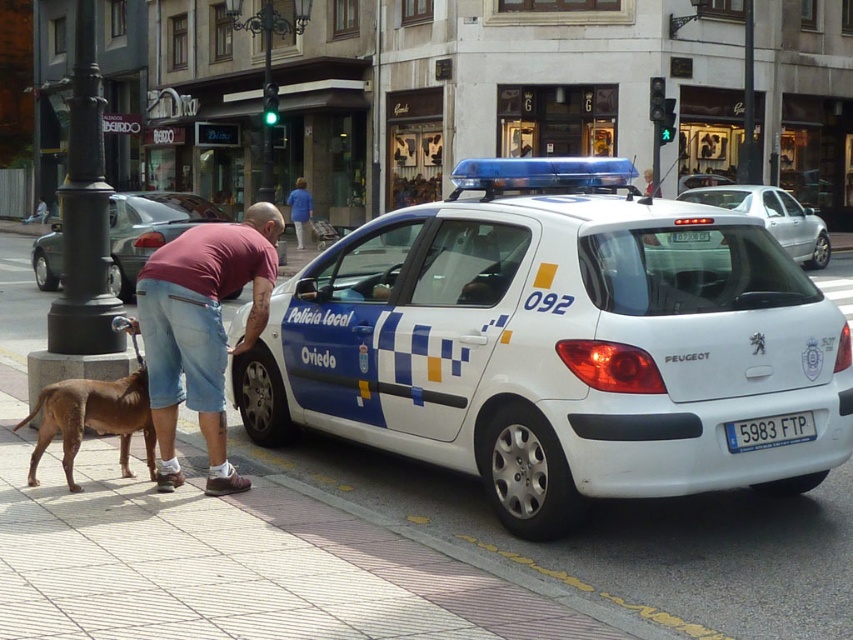
Question: Which object appears farthest from the camera in this image?

Choices:
 (A) white plastic license plate at center
 (B) white glossy police car at center

Answer: (A)

Question: Considering the real-world distances, which object is farthest from the blue metallic license plate at center?

Choices:
 (A) white glossy police car at center
 (B) brown smooth dog at lower left
 (C) white glossy car at left

Answer: (C)

Question: Can you confirm if white glossy police car at center is positioned to the right of white plastic license plate at center?

Choices:
 (A) no
 (B) yes

Answer: (A)

Question: Can you confirm if pink cotton t-shirt at center is wider than brown smooth dog at lower left?

Choices:
 (A) yes
 (B) no

Answer: (A)

Question: Is brown smooth dog at lower left to the right of silver metallic sedan at center from the viewer's perspective?

Choices:
 (A) yes
 (B) no

Answer: (B)

Question: Considering the real-world distances, which object is farthest from the blue metallic license plate at center?

Choices:
 (A) white glossy police car at center
 (B) white plastic license plate at center
 (C) pink cotton t-shirt at center

Answer: (C)